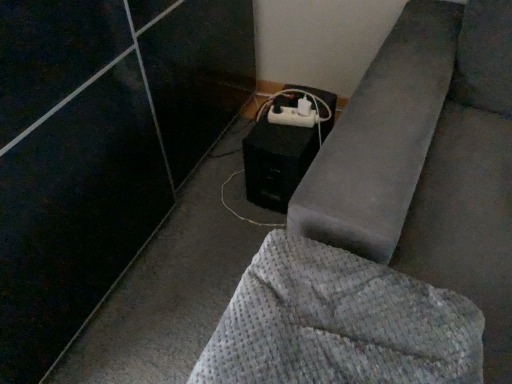
This screenshot has width=512, height=384. Describe the element at coordinates (277, 162) in the screenshot. I see `black matte speaker at lower center` at that location.

At what (x,y) coordinates should I click in order to perform the action: click on black matte speaker at lower center. Please return your answer as a coordinate pair (x, y). This screenshot has width=512, height=384. Looking at the image, I should click on (277, 162).

In the scene shown: Is white plastic extension cord at lower center positioned with its back to black matte speaker at lower center?

white plastic extension cord at lower center does not have its back to black matte speaker at lower center.

Is the surface of white plastic extension cord at lower center in direct contact with black matte speaker at lower center?

No, white plastic extension cord at lower center is not with black matte speaker at lower center.

What are the coordinates of `extension cord behind the black matte speaker at lower center` in the screenshot? It's located at (292, 117).

From the image's perspective, is white plastic extension cord at lower center under black matte speaker at lower center?

No.

Is waffle-textured gray blanket at lower right located within black matte speaker at lower center?

No, waffle-textured gray blanket at lower right is not a part of black matte speaker at lower center.

Is black matte speaker at lower center positioned behind waffle-textured gray blanket at lower right?

Yes, black matte speaker at lower center is behind waffle-textured gray blanket at lower right.

Which object is positioned more to the right, black matte speaker at lower center or waffle-textured gray blanket at lower right?

waffle-textured gray blanket at lower right is more to the right.

How far apart are black matte speaker at lower center and waffle-textured gray blanket at lower right?

black matte speaker at lower center is 26.71 inches from waffle-textured gray blanket at lower right.

In terms of height, does waffle-textured gray blanket at lower right look taller or shorter compared to black matte speaker at lower center?

Considering their sizes, waffle-textured gray blanket at lower right has less height than black matte speaker at lower center.

Is the depth of waffle-textured gray blanket at lower right greater than that of black matte speaker at lower center?

No, waffle-textured gray blanket at lower right is in front of black matte speaker at lower center.

Is black matte speaker at lower center positioned behind white plastic extension cord at lower center?

No, black matte speaker at lower center is closer to the camera.

Find the location of a particular element. Image resolution: width=512 pixels, height=384 pixels. speaker in front of the white plastic extension cord at lower center is located at coordinates (277, 162).

What's the angular difference between black matte speaker at lower center and white plastic extension cord at lower center's facing directions?

There is a 10.5-degree angle between the facing directions of black matte speaker at lower center and white plastic extension cord at lower center.

Based on the photo, can you confirm if black matte speaker at lower center is taller than white plastic extension cord at lower center?

Indeed, black matte speaker at lower center has a greater height compared to white plastic extension cord at lower center.

Does white plastic extension cord at lower center have a larger size compared to waffle-textured gray blanket at lower right?

No, white plastic extension cord at lower center is not bigger than waffle-textured gray blanket at lower right.

At what (x,y) coordinates should I click in order to perform the action: click on extension cord below the waffle-textured gray blanket at lower right (from a real-world perspective). Please return your answer as a coordinate pair (x, y). Looking at the image, I should click on (292, 117).

Is point (306, 125) farther from camera compared to point (368, 372)?

Yes, it is.

Is waffle-textured gray blanket at lower right positioned with its back to white plastic extension cord at lower center?

No.

Is point (271, 373) closer to viewer compared to point (281, 117)?

Yes, it is in front of point (281, 117).

From their relative heights in the image, would you say waffle-textured gray blanket at lower right is taller or shorter than white plastic extension cord at lower center?

Considering their sizes, waffle-textured gray blanket at lower right has more height than white plastic extension cord at lower center.

You are a GUI agent. You are given a task and a screenshot of the screen. Output one action in this format:
    pyautogui.click(x=<x>, y=<y>)
    Task: Click on the furniture in front of the white plastic extension cord at lower center
    
    Given the screenshot: What is the action you would take?
    pyautogui.click(x=339, y=324)

The height and width of the screenshot is (384, 512). Identify the location of speaker in front of the white plastic extension cord at lower center. (277, 162).

Identify the location of furniture below the black matte speaker at lower center (from the image's perspective). (339, 324).

Which object lies nearer to the anchor point black matte speaker at lower center, waffle-textured gray blanket at lower right or white plastic extension cord at lower center?

white plastic extension cord at lower center lies closer to black matte speaker at lower center than the other object.

Which object lies nearer to the anchor point waffle-textured gray blanket at lower right, black matte speaker at lower center or white plastic extension cord at lower center?

black matte speaker at lower center is positioned closer to the anchor waffle-textured gray blanket at lower right.

Looking at this image, based on their spatial positions, is black matte speaker at lower center or waffle-textured gray blanket at lower right further from white plastic extension cord at lower center?

waffle-textured gray blanket at lower right.

When comparing their distances from black matte speaker at lower center, does white plastic extension cord at lower center or waffle-textured gray blanket at lower right seem further?

The object further to black matte speaker at lower center is waffle-textured gray blanket at lower right.

Considering their positions, is white plastic extension cord at lower center positioned closer to waffle-textured gray blanket at lower right than black matte speaker at lower center?

black matte speaker at lower center is closer to waffle-textured gray blanket at lower right.

When comparing their distances from white plastic extension cord at lower center, does waffle-textured gray blanket at lower right or black matte speaker at lower center seem further?

waffle-textured gray blanket at lower right is further to white plastic extension cord at lower center.

Find the location of `speaker between waffle-textured gray blanket at lower right and white plastic extension cord at lower center along the z-axis`. speaker between waffle-textured gray blanket at lower right and white plastic extension cord at lower center along the z-axis is located at coordinates (277, 162).